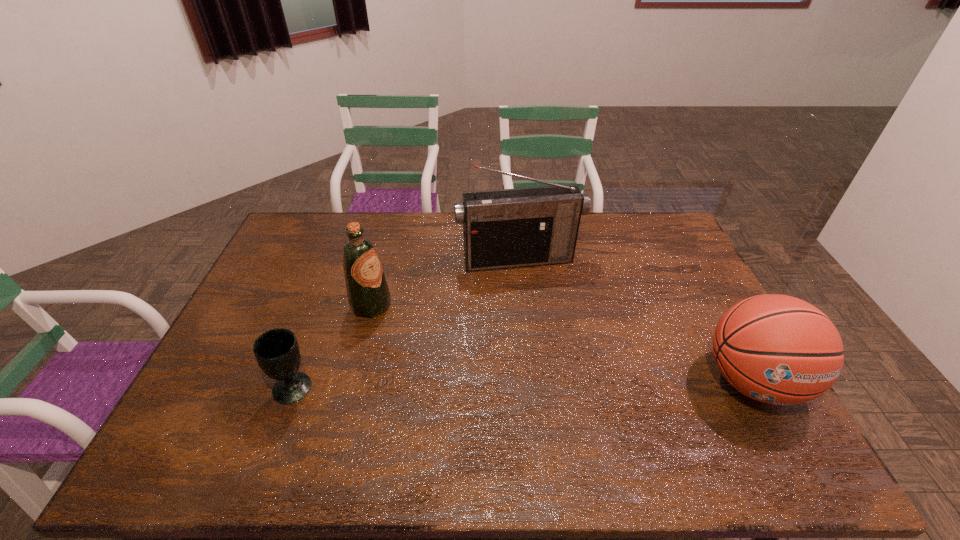
The image size is (960, 540). In order to click on free spot located 0.210m on the front-facing side of the second object from left to right in this screenshot , I will do point(442,342).

In order to click on vacant space located 0.390m on the front-facing side of the tallest object in this screenshot , I will do `click(557, 367)`.

Find the location of a particular element. The image size is (960, 540). free spot located on the front-facing side of the tallest object is located at coordinates (549, 341).

Locate an element on the screen. Image resolution: width=960 pixels, height=540 pixels. free space located on the front-facing side of the tallest object is located at coordinates (548, 339).

The height and width of the screenshot is (540, 960). Find the location of `object located at the far edge`. object located at the far edge is located at coordinates (506, 228).

Locate an element on the screen. The image size is (960, 540). chalice at the near edge is located at coordinates (277, 352).

In order to click on basketball located at the near edge in this screenshot , I will do `click(777, 349)`.

You are a GUI agent. You are given a task and a screenshot of the screen. Output one action in this format:
    pyautogui.click(x=<x>, y=<y>)
    Task: Click on the object that is positioned at the right edge
    
    Given the screenshot: What is the action you would take?
    pyautogui.click(x=777, y=349)

The width and height of the screenshot is (960, 540). Find the location of `object located at the near right corner`. object located at the near right corner is located at coordinates pos(777,349).

Find the location of a particular element. vacant area at the far edge is located at coordinates (593, 213).